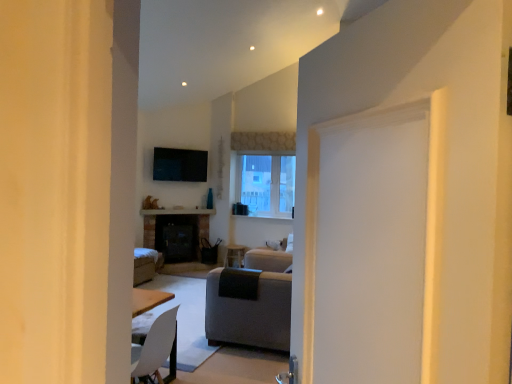
Question: In terms of height, does gray fabric couch at center look taller or shorter compared to clear glass window at center?

Choices:
 (A) tall
 (B) short

Answer: (B)

Question: Considering their positions, is gray fabric couch at center located in front of or behind clear glass window at center?

Choices:
 (A) front
 (B) behind

Answer: (A)

Question: Is point (266, 309) closer or farther from the camera than point (265, 180)?

Choices:
 (A) farther
 (B) closer

Answer: (B)

Question: Considering the positions of clear glass window at center and gray fabric couch at center in the image, is clear glass window at center wider or thinner than gray fabric couch at center?

Choices:
 (A) wide
 (B) thin

Answer: (B)

Question: Considering the positions of clear glass window at center and gray fabric couch at center in the image, is clear glass window at center taller or shorter than gray fabric couch at center?

Choices:
 (A) tall
 (B) short

Answer: (A)

Question: Would you say clear glass window at center is to the left or to the right of gray fabric couch at center in the picture?

Choices:
 (A) left
 (B) right

Answer: (B)

Question: Would you say clear glass window at center is inside or outside gray fabric couch at center?

Choices:
 (A) outside
 (B) inside

Answer: (A)